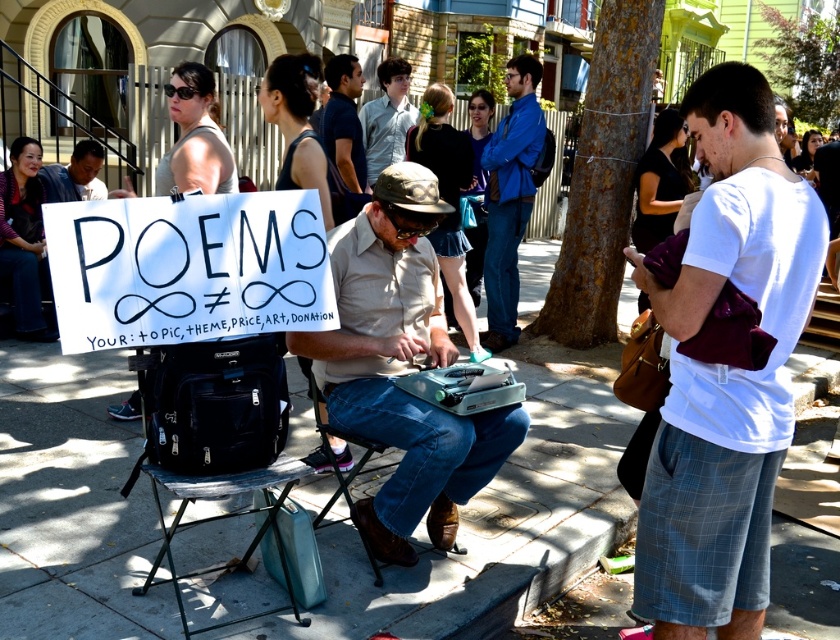
Which is in front, point (749, 589) or point (79, 195)?

Point (749, 589)

Between white cotton t-shirt at center and matte black shirt at left, which one has less height?

matte black shirt at left

This screenshot has width=840, height=640. In order to click on white cotton t-shirt at center in this screenshot , I will do `click(725, 371)`.

Is dark blue shirt at center taller than matte black shirt at left?

Yes, dark blue shirt at center is taller than matte black shirt at left.

Is dark blue shirt at center shorter than matte black shirt at left?

Incorrect, dark blue shirt at center's height does not fall short of matte black shirt at left's.

Is point (355, 106) less distant than point (66, 172)?

Yes, point (355, 106) is closer to viewer.

You are a GUI agent. You are given a task and a screenshot of the screen. Output one action in this format:
    pyautogui.click(x=<x>, y=<y>)
    Task: Click on the dark blue shirt at center
    Image resolution: width=840 pixels, height=640 pixels.
    Given the screenshot: What is the action you would take?
    pyautogui.click(x=344, y=120)

Who is lower down, black fabric folding chair at lower left or matte black shirt at left?

black fabric folding chair at lower left is lower down.

What do you see at coordinates (216, 442) in the screenshot?
I see `black fabric folding chair at lower left` at bounding box center [216, 442].

Is point (171, 426) positioned after point (55, 168)?

No.

Where is `black fabric folding chair at lower left`? This screenshot has height=640, width=840. black fabric folding chair at lower left is located at coordinates (216, 442).